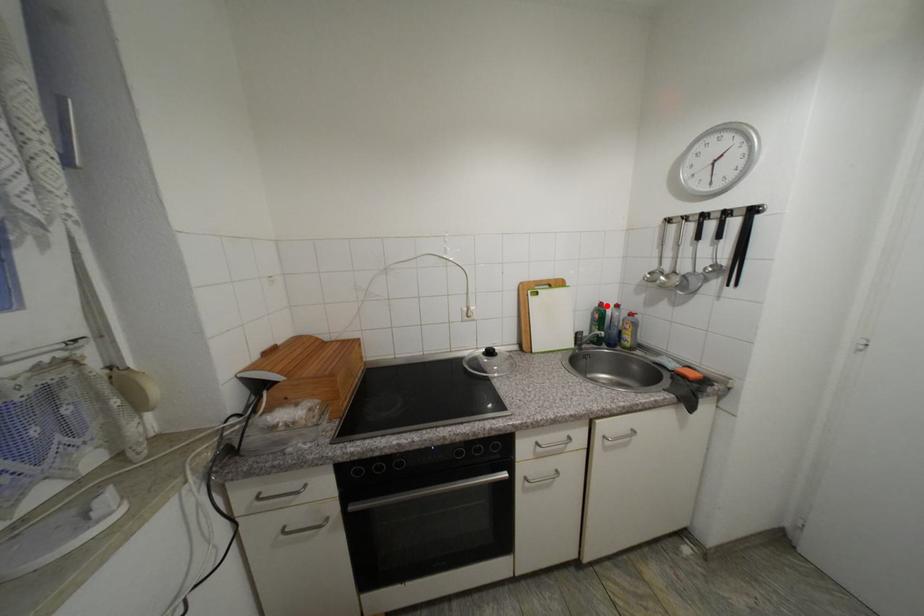
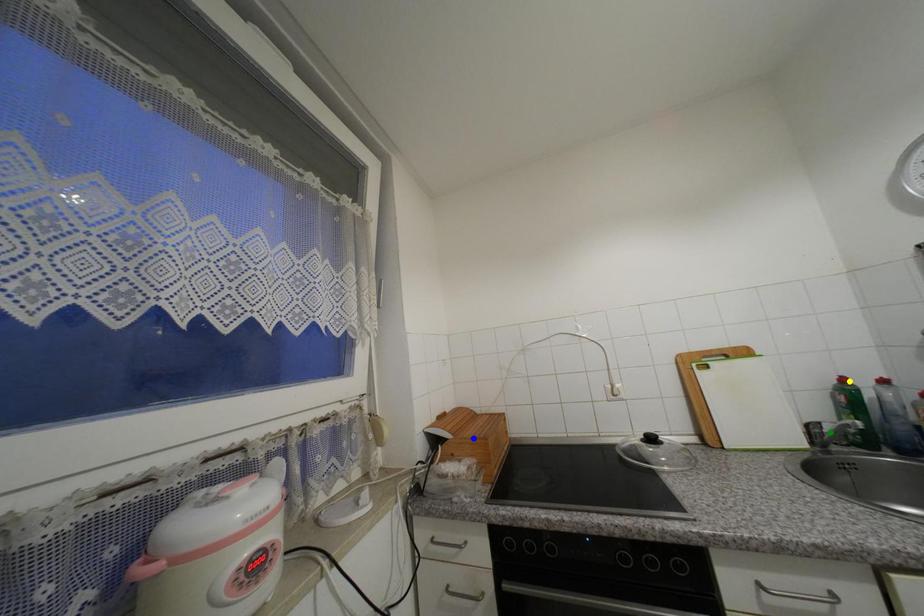
Question: I am providing you with two images of the same scene from different viewpoints. A red point is marked on the first image. You are given multiple points on the second image. Can you choose the point in image 2 that corresponds to the point in image 1?

Choices:
 (A) blue point
 (B) green point
 (C) yellow point

Answer: (C)